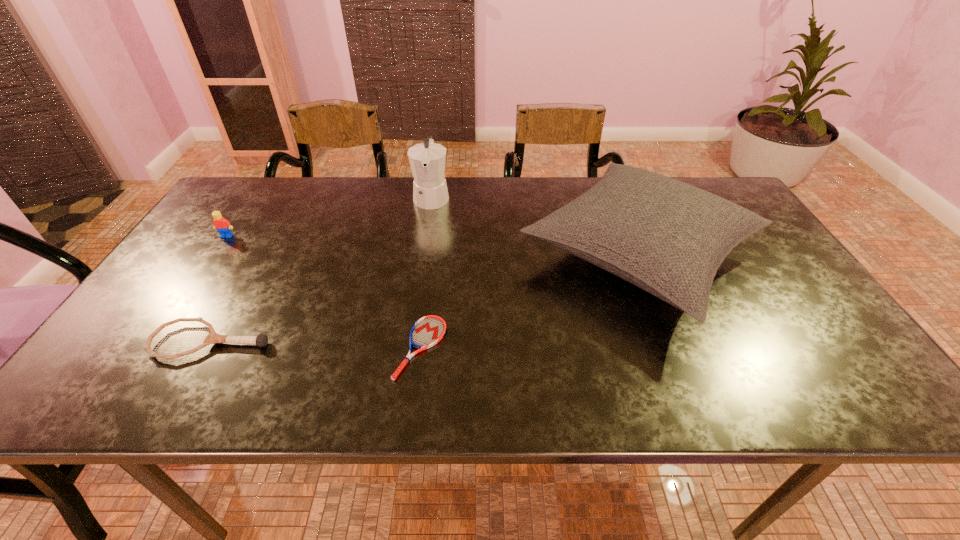
Image resolution: width=960 pixels, height=540 pixels. I want to click on coffeepot, so click(x=427, y=160).

The height and width of the screenshot is (540, 960). Identify the location of cushion. (669, 238).

Identify the location of the third shortest object. (223, 226).

I want to click on the taller tennis racket, so 261,340.

This screenshot has width=960, height=540. I want to click on the left tennis racket, so click(261, 340).

Find the location of a particular element. This screenshot has height=540, width=960. the right tennis racket is located at coordinates coord(429,330).

This screenshot has width=960, height=540. Identify the location of the shortest object. pyautogui.click(x=429, y=330).

Identify the location of vacant space located 0.060m at the spout of the coffeepot. The image size is (960, 540). (427, 226).

You are a GUI agent. You are given a task and a screenshot of the screen. Output one action in this format:
    pyautogui.click(x=<x>, y=<y>)
    Task: Click on the free point located on the left of the rightmost object
    This screenshot has height=540, width=960.
    Given the screenshot: What is the action you would take?
    pyautogui.click(x=409, y=255)

At what (x,y) coordinates should I click in order to perform the action: click on free space located on the face of the third tallest object. Please return your answer as a coordinate pair (x, y). Looking at the image, I should click on (180, 306).